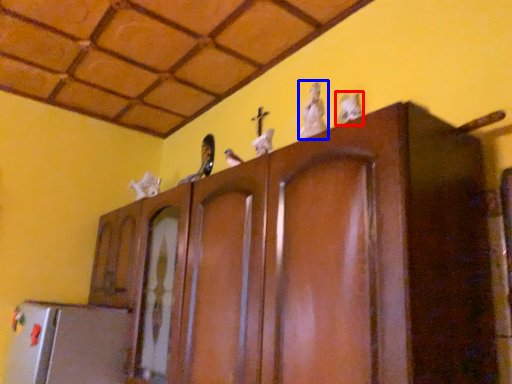
Question: Among these objects, which one is nearest to the camera, animal (highlighted by a red box) or animal (highlighted by a blue box)?

Choices:
 (A) animal
 (B) animal

Answer: (A)